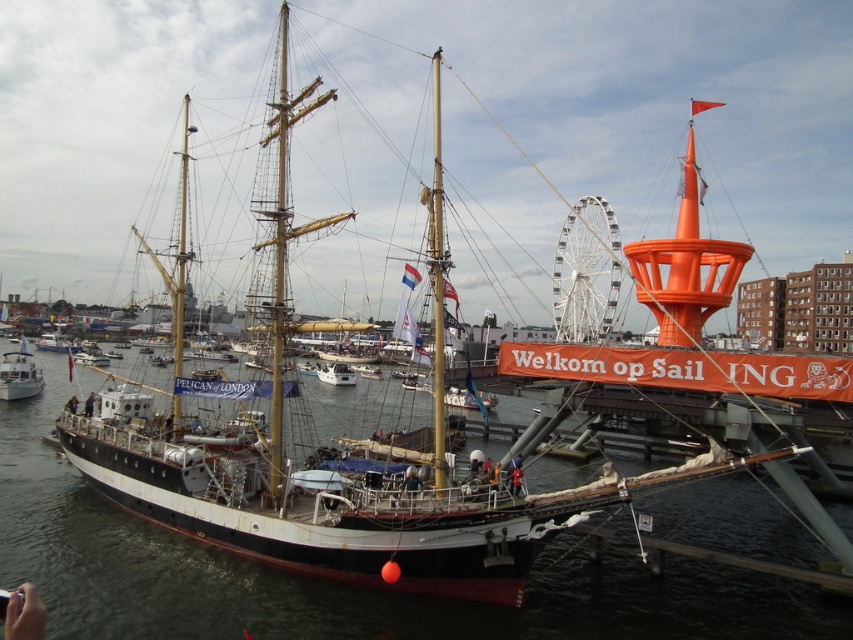
Between point (6, 356) and point (329, 371), which one is positioned behind?

The point (329, 371) is behind.

The image size is (853, 640). Identify the location of white glossy boat at center. (19, 376).

Image resolution: width=853 pixels, height=640 pixels. Identify the location of white glossy boat at center. click(19, 376).

The width and height of the screenshot is (853, 640). Describe the element at coordinates (437, 282) in the screenshot. I see `wooden mast at center` at that location.

Who is more distant from viewer, (x=434, y=186) or (x=350, y=378)?

The point (x=350, y=378) is behind.

Who is more forward, [434,268] or [338,362]?

Point [434,268] is in front.

Find the location of a particular element. wooden mast at center is located at coordinates (x=437, y=282).

Is the position of black water at center less distant than that of white glossy boat at center?

Yes, it is in front of white glossy boat at center.

From the picture: Does black water at center have a larger size compared to white glossy boat at center?

Correct, black water at center is larger in size than white glossy boat at center.

Between point (737, 637) and point (28, 380), which one is positioned behind?

The point (28, 380) is more distant.

You are a GUI agent. You are given a task and a screenshot of the screen. Output one action in this format:
    pyautogui.click(x=<x>, y=<y>)
    Task: Click on the black water at center
    This screenshot has height=640, width=853.
    Given the screenshot: What is the action you would take?
    pyautogui.click(x=334, y=582)